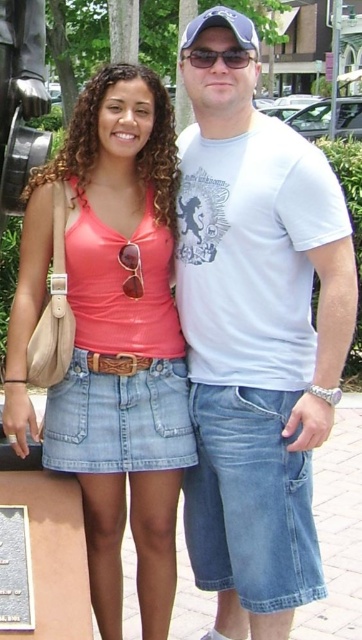
You are standing at the origin of a coordinate system placed at the bottom left corner of the image. You see two points, point 1 at coordinates point (215, 124) and point 2 at coordinates point (86, 189). Which point is closer to you?

Point 2 at coordinates point (86, 189) is closer to you because it has a smaller y coordinate value, meaning it is positioned lower in the image and thus closer to the origin at the bottom left corner.